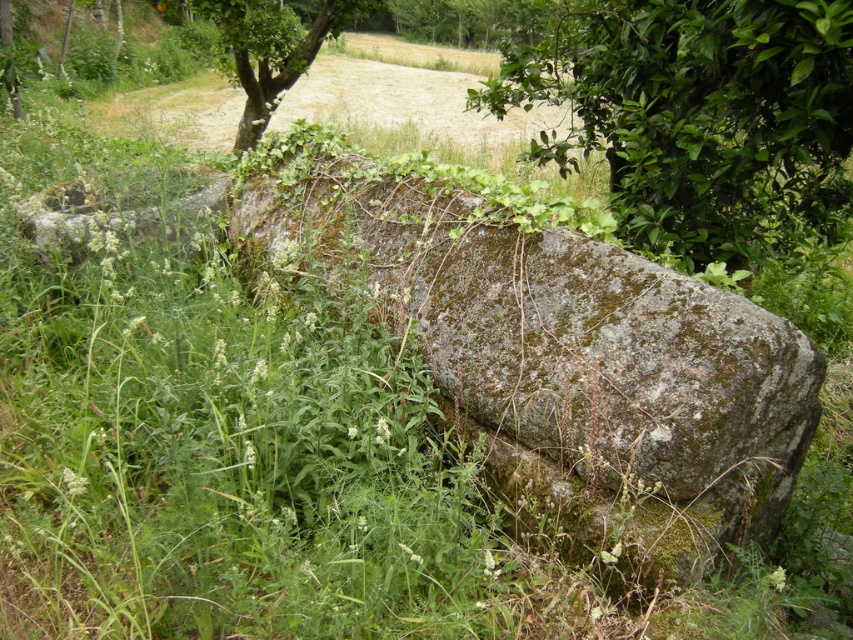
You are a hiker who wants to take a photo of the mossy stone boulder at center and the green leafy tree at upper right. Which object should you focus on first if you want to include both in your frame without moving the camera?

The mossy stone boulder at center is larger in size than the green leafy tree at upper right, so you should focus on the mossy stone boulder at center first to ensure it fits properly in the frame before adjusting for the smaller tree.